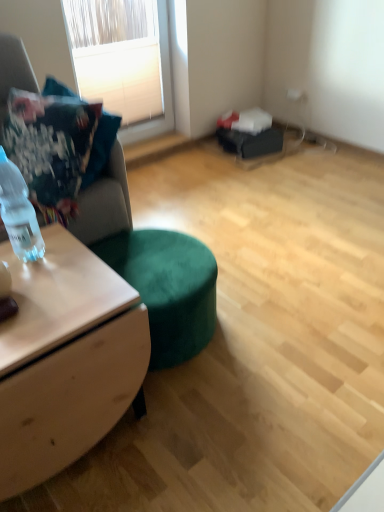
Where is `free space on the front side of clear plastic bottle at left`? free space on the front side of clear plastic bottle at left is located at coordinates (44, 284).